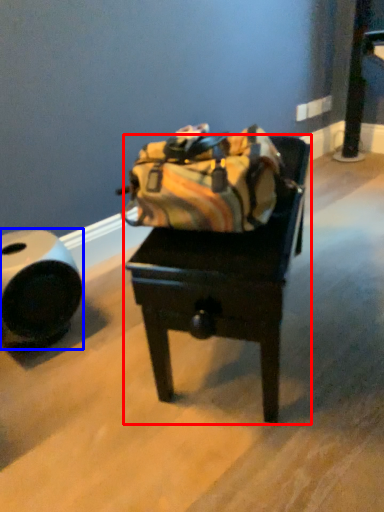
Question: Among these objects, which one is farthest to the camera, furniture (highlighted by a red box) or tube (highlighted by a blue box)?

Choices:
 (A) furniture
 (B) tube

Answer: (B)